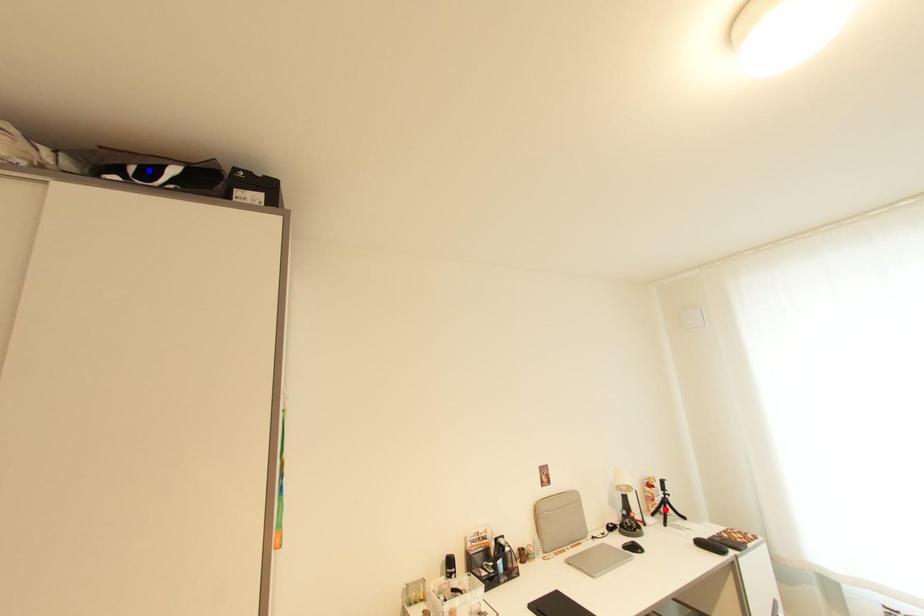
Question: Two points are marked on the image. Which point is closer to the camera?

Choices:
 (A) Blue point is closer.
 (B) Red point is closer.

Answer: (A)